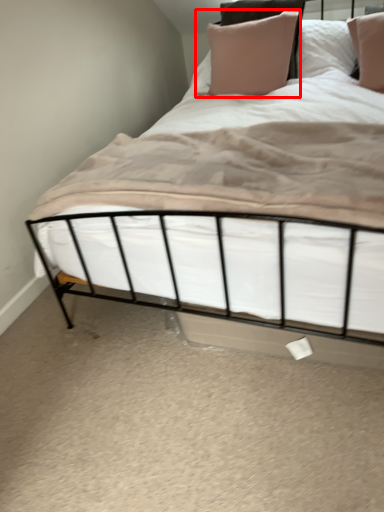
Question: Considering the relative positions of pillow (annotated by the red box) and sheet in the image provided, where is pillow (annotated by the red box) located with respect to the staircase?

Choices:
 (A) right
 (B) left

Answer: (A)